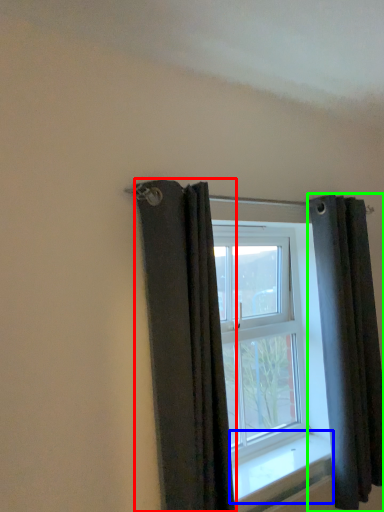
Question: Which object is positioned farthest from curtain (highlighted by a red box)? Select from window sill (highlighted by a blue box) and curtain (highlighted by a green box).

Choices:
 (A) window sill
 (B) curtain

Answer: (B)